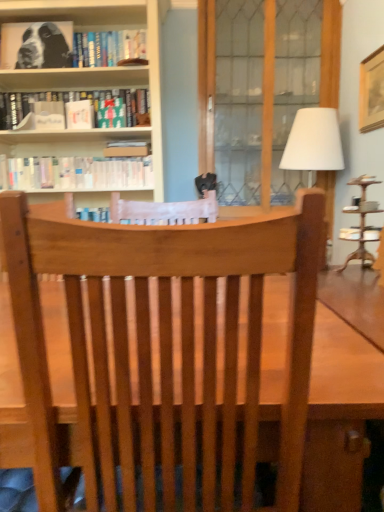
Question: Is black and white print at upper left, arranged as the 1th book when viewed from the top, smaller than white paperbacks at upper left, the 3th book when ordered from top to bottom?

Choices:
 (A) no
 (B) yes

Answer: (B)

Question: Is white paperbacks at upper left, the 3th book when ordered from top to bottom, at the back of black and white print at upper left, arranged as the 1th book when viewed from the top?

Choices:
 (A) yes
 (B) no

Answer: (B)

Question: Considering the relative positions of black and white print at upper left, arranged as the 1th book when viewed from the top, and white paperbacks at upper left, the 1th book ordered from the bottom, in the image provided, is black and white print at upper left, arranged as the 1th book when viewed from the top, to the left of white paperbacks at upper left, the 1th book ordered from the bottom, from the viewer's perspective?

Choices:
 (A) yes
 (B) no

Answer: (A)

Question: From a real-world perspective, is black and white print at upper left, arranged as the 1th book when viewed from the top, located higher than white paperbacks at upper left, the 3th book when ordered from top to bottom?

Choices:
 (A) no
 (B) yes

Answer: (B)

Question: Can you see black and white print at upper left, acting as the third book starting from the bottom, touching white paperbacks at upper left, the 3th book when ordered from top to bottom?

Choices:
 (A) no
 (B) yes

Answer: (A)

Question: From a real-world perspective, is black and white print at upper left, arranged as the 1th book when viewed from the top, located beneath white paperbacks at upper left, the 1th book ordered from the bottom?

Choices:
 (A) yes
 (B) no

Answer: (B)

Question: Are wooden screen door at center and black and white print at upper left, arranged as the 1th book when viewed from the top, located far from each other?

Choices:
 (A) yes
 (B) no

Answer: (B)

Question: Is the depth of wooden screen door at center greater than that of black and white print at upper left, arranged as the 1th book when viewed from the top?

Choices:
 (A) yes
 (B) no

Answer: (A)

Question: Considering the relative sizes of wooden screen door at center and black and white print at upper left, arranged as the 1th book when viewed from the top, in the image provided, is wooden screen door at center smaller than black and white print at upper left, arranged as the 1th book when viewed from the top,?

Choices:
 (A) no
 (B) yes

Answer: (A)

Question: Considering the relative sizes of wooden screen door at center and black and white print at upper left, acting as the third book starting from the bottom, in the image provided, is wooden screen door at center thinner than black and white print at upper left, acting as the third book starting from the bottom,?

Choices:
 (A) no
 (B) yes

Answer: (A)

Question: Considering the relative sizes of wooden screen door at center and black and white print at upper left, arranged as the 1th book when viewed from the top, in the image provided, is wooden screen door at center shorter than black and white print at upper left, arranged as the 1th book when viewed from the top,?

Choices:
 (A) no
 (B) yes

Answer: (A)

Question: Is wooden screen door at center facing away from black and white print at upper left, arranged as the 1th book when viewed from the top?

Choices:
 (A) yes
 (B) no

Answer: (B)

Question: Can you confirm if white matte book at upper center is shorter than wooden picture frame at upper right?

Choices:
 (A) no
 (B) yes

Answer: (B)